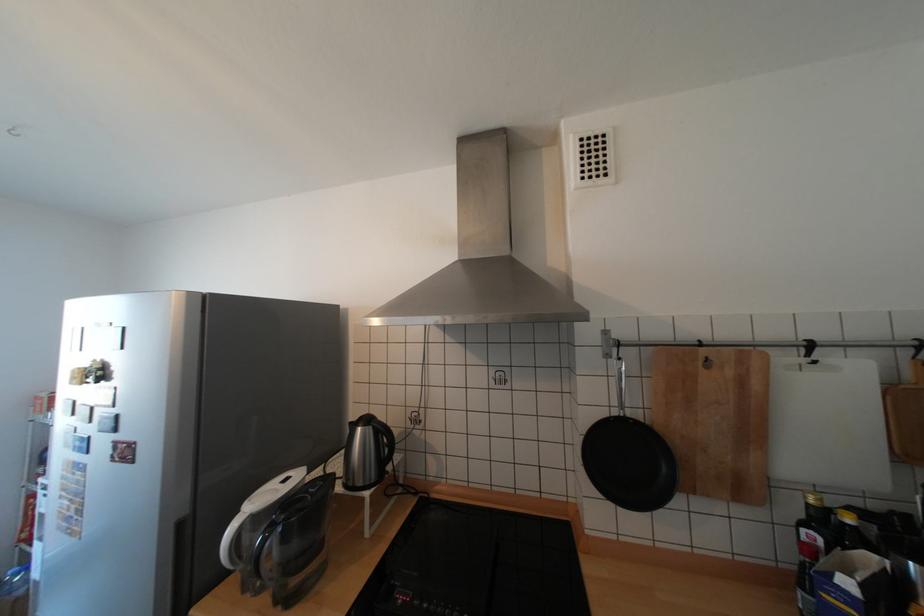
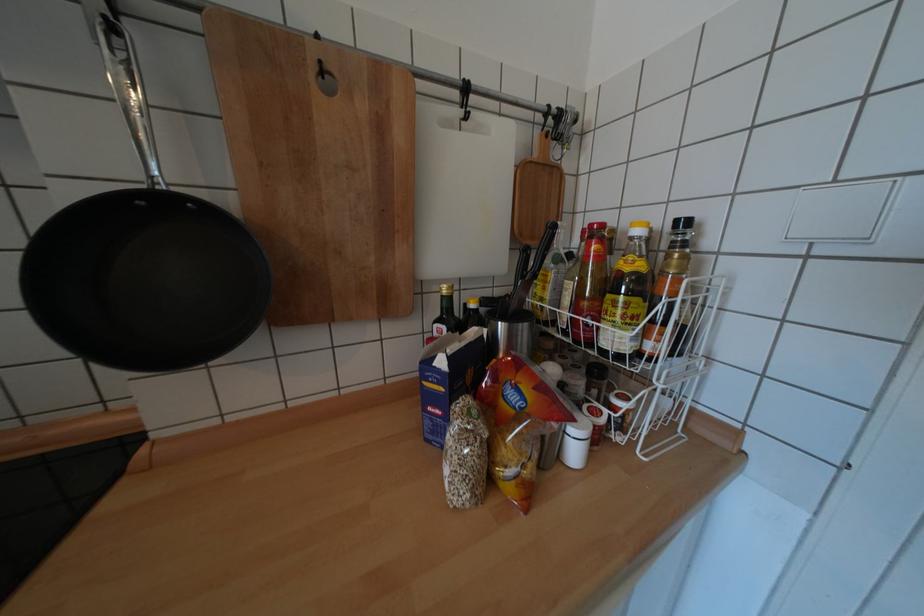
The images are taken continuously from a first-person perspective. In which direction is your viewpoint rotating?

The rotation direction of the camera is right-down.